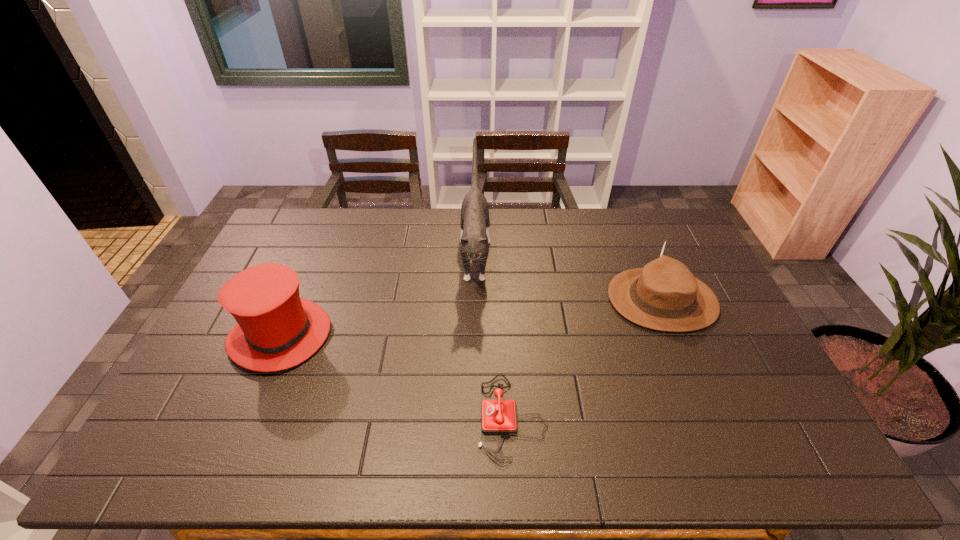
In order to click on blank space at the left edge of the desktop in this screenshot , I will do `click(195, 393)`.

In the image, there is a desktop. Find the location of `vacant space at the right edge`. vacant space at the right edge is located at coordinates (763, 401).

Find the location of `free space at the far left corner of the desktop`. free space at the far left corner of the desktop is located at coordinates (298, 231).

This screenshot has width=960, height=540. I want to click on empty location between the tallest object and the second shortest object, so click(568, 278).

The image size is (960, 540). Find the location of `free space between the telephone and the tallest object`. free space between the telephone and the tallest object is located at coordinates (493, 336).

I want to click on free space between the second shortest object and the leftmost object, so click(x=471, y=318).

Identify the location of free point between the hat and the cat. (378, 295).

Where is `free space between the tallest object and the telephone`? Image resolution: width=960 pixels, height=540 pixels. free space between the tallest object and the telephone is located at coordinates (493, 336).

Locate an element on the screen. empty space that is in between the shortest object and the cat is located at coordinates (493, 336).

Locate an element on the screen. The width and height of the screenshot is (960, 540). unoccupied area between the shortest object and the leftmost object is located at coordinates (396, 376).